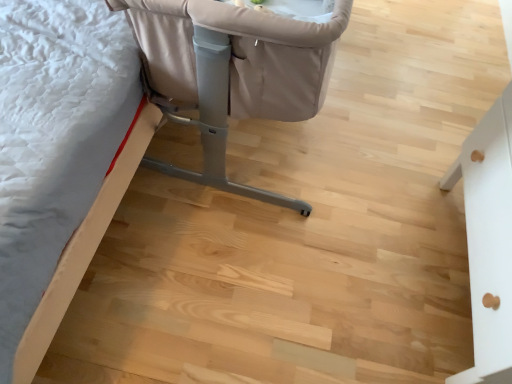
Question: In terms of size, does beige fabric crib at upper left, the 3th furniture in the right-to-left sequence, appear bigger or smaller than white matte drawer at right, which is counted as the first furniture, starting from the right?

Choices:
 (A) big
 (B) small

Answer: (A)

Question: From the image's perspective, is beige fabric crib at upper left, which is counted as the first furniture, starting from the left, positioned above or below white matte drawer at right, which appears as the third furniture when viewed from the left?

Choices:
 (A) above
 (B) below

Answer: (A)

Question: Based on their relative distances, which object is farther from the beige fabric crib at upper left, which is counted as the first furniture, starting from the left?

Choices:
 (A) beige fabric crib at upper center, the second furniture from the right
 (B) white matte drawer at right, which appears as the third furniture when viewed from the left

Answer: (B)

Question: Which object is the closest to the beige fabric crib at upper center, the second furniture from the right?

Choices:
 (A) white matte drawer at right, which appears as the third furniture when viewed from the left
 (B) beige fabric crib at upper left, which is counted as the first furniture, starting from the left

Answer: (B)